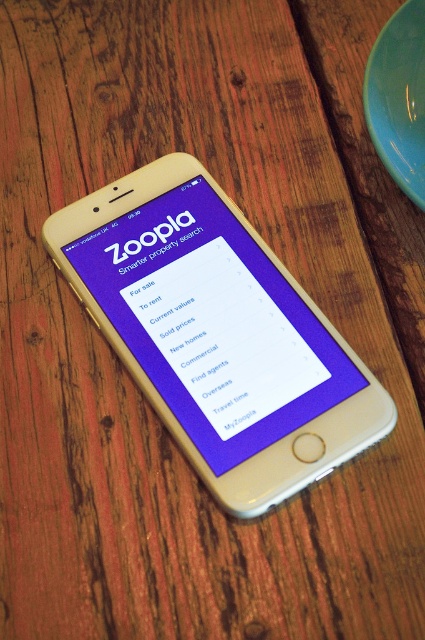
Question: Can you confirm if purple matte screen at center is positioned below matte green plate at upper right?

Choices:
 (A) yes
 (B) no

Answer: (A)

Question: Does purple matte screen at center have a greater width compared to matte green plate at upper right?

Choices:
 (A) no
 (B) yes

Answer: (B)

Question: Observing the image, what is the correct spatial positioning of purple matte screen at center in reference to matte green plate at upper right?

Choices:
 (A) below
 (B) above

Answer: (A)

Question: Which of the following is the closest to the observer?

Choices:
 (A) purple matte screen at center
 (B) matte green plate at upper right

Answer: (A)